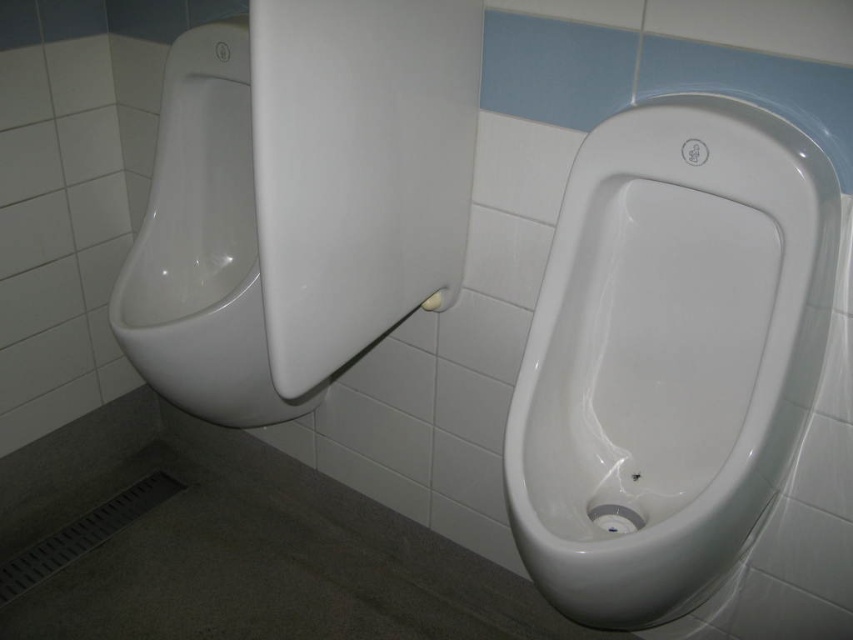
Is white glossy urinal at center shorter than white glossy urinal at left?

Yes, white glossy urinal at center is shorter than white glossy urinal at left.

Is point (654, 225) closer to camera compared to point (160, 284)?

Yes, point (654, 225) is in front of point (160, 284).

Who is more distant from viewer, (566, 298) or (257, 412)?

Positioned behind is point (257, 412).

Where is `white glossy urinal at center`? This screenshot has width=853, height=640. white glossy urinal at center is located at coordinates (668, 355).